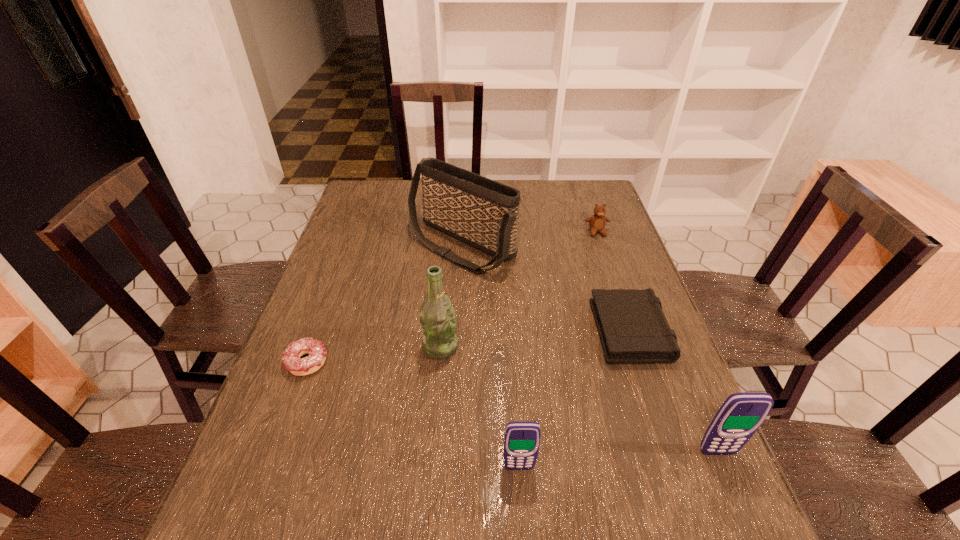
Find the location of a particular element. free location that satisfies the following two spatial constraints: 1. at the face of the Bible; 2. on the right side of the fifth tallest object is located at coordinates (630, 327).